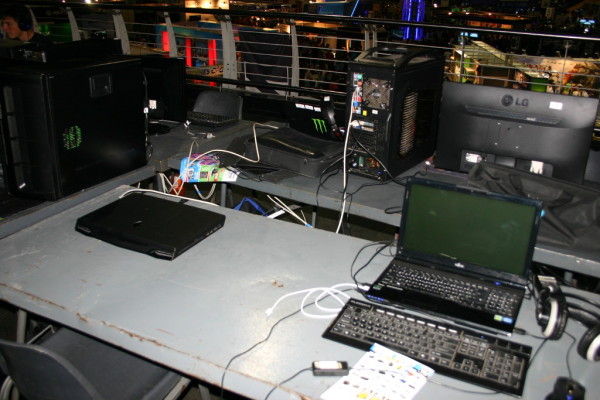
The width and height of the screenshot is (600, 400). What are the coordinates of `desktop` in the screenshot? It's located at (465, 110).